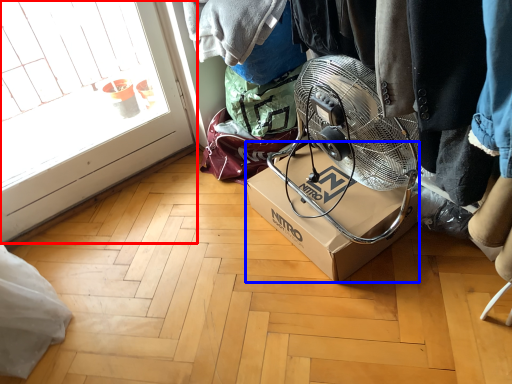
Question: Which point is further to the camera, glass door (highlighted by a red box) or box (highlighted by a blue box)?

Choices:
 (A) glass door
 (B) box

Answer: (B)